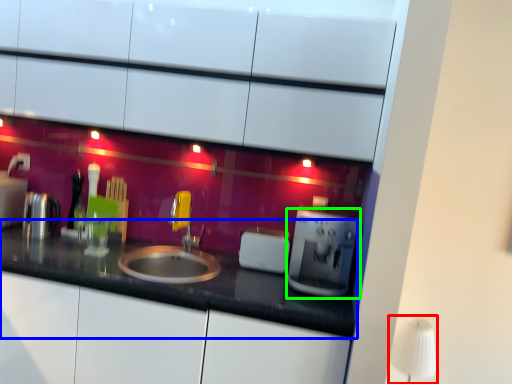
Question: Which object is positioned closest to table lamp (highlighted by a red box)? Select from countertop (highlighted by a blue box) and coffee machine (highlighted by a green box).

Choices:
 (A) countertop
 (B) coffee machine

Answer: (B)